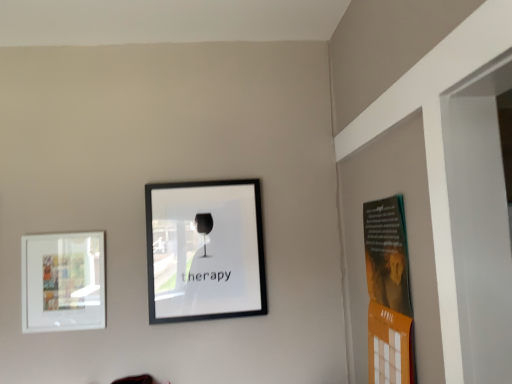
This screenshot has height=384, width=512. Describe the element at coordinates (205, 250) in the screenshot. I see `black matte picture frame at center, acting as the first picture frame starting from the right` at that location.

Identify the location of black matte picture frame at center, the 2th picture frame positioned from the left. (205, 250).

In order to face white matte picture frame at left, positioned as the first picture frame in left-to-right order, should I rotate leftwards or rightwards?

A 24.301 degree turn to the left will do.

You are a GUI agent. You are given a task and a screenshot of the screen. Output one action in this format:
    pyautogui.click(x=<x>, y=<y>)
    Task: Click on the white matte picture frame at left, positioned as the first picture frame in left-to-right order
    Image resolution: width=512 pixels, height=384 pixels.
    Given the screenshot: What is the action you would take?
    pyautogui.click(x=63, y=282)

What do you see at coordinates (63, 282) in the screenshot? Image resolution: width=512 pixels, height=384 pixels. I see `white matte picture frame at left, positioned as the first picture frame in left-to-right order` at bounding box center [63, 282].

At what (x,y) coordinates should I click in order to perform the action: click on black matte picture frame at center, the 2th picture frame positioned from the left. Please return your answer as a coordinate pair (x, y). The width and height of the screenshot is (512, 384). Looking at the image, I should click on click(x=205, y=250).

Based on their positions, is white matte picture frame at left, acting as the second picture frame starting from the right, located to the left or right of black matte picture frame at center, acting as the first picture frame starting from the right?

white matte picture frame at left, acting as the second picture frame starting from the right, is positioned on black matte picture frame at center, acting as the first picture frame starting from the right,'s left side.

From the picture: Is white matte picture frame at left, positioned as the first picture frame in left-to-right order, further to camera compared to black matte picture frame at center, the 2th picture frame positioned from the left?

That is False.

Is point (75, 244) closer to viewer compared to point (243, 285)?

Yes, it is in front of point (243, 285).

From the image's perspective, which is below, white matte picture frame at left, positioned as the first picture frame in left-to-right order, or black matte picture frame at center, the 2th picture frame positioned from the left?

white matte picture frame at left, positioned as the first picture frame in left-to-right order, from the image's perspective.

From a real-world perspective, is white matte picture frame at left, positioned as the first picture frame in left-to-right order, above or below black matte picture frame at center, acting as the first picture frame starting from the right?

From a real-world perspective, white matte picture frame at left, positioned as the first picture frame in left-to-right order, is physically below black matte picture frame at center, acting as the first picture frame starting from the right.

Considering the relative sizes of white matte picture frame at left, acting as the second picture frame starting from the right, and black matte picture frame at center, acting as the first picture frame starting from the right, in the image provided, is white matte picture frame at left, acting as the second picture frame starting from the right, thinner than black matte picture frame at center, acting as the first picture frame starting from the right,?

Correct, the width of white matte picture frame at left, acting as the second picture frame starting from the right, is less than that of black matte picture frame at center, acting as the first picture frame starting from the right.

Considering the sizes of objects white matte picture frame at left, positioned as the first picture frame in left-to-right order, and black matte picture frame at center, the 2th picture frame positioned from the left, in the image provided, who is shorter, white matte picture frame at left, positioned as the first picture frame in left-to-right order, or black matte picture frame at center, the 2th picture frame positioned from the left,?

With less height is white matte picture frame at left, positioned as the first picture frame in left-to-right order.

Does white matte picture frame at left, acting as the second picture frame starting from the right, have a smaller size compared to black matte picture frame at center, the 2th picture frame positioned from the left?

Indeed, white matte picture frame at left, acting as the second picture frame starting from the right, has a smaller size compared to black matte picture frame at center, the 2th picture frame positioned from the left.

Is white matte picture frame at left, positioned as the first picture frame in left-to-right order, situated inside black matte picture frame at center, the 2th picture frame positioned from the left, or outside?

white matte picture frame at left, positioned as the first picture frame in left-to-right order, exists outside the volume of black matte picture frame at center, the 2th picture frame positioned from the left.

Is white matte picture frame at left, positioned as the first picture frame in left-to-right order, not near black matte picture frame at center, acting as the first picture frame starting from the right?

No, white matte picture frame at left, positioned as the first picture frame in left-to-right order, is not far from black matte picture frame at center, acting as the first picture frame starting from the right.

Could you tell me if white matte picture frame at left, acting as the second picture frame starting from the right, is turned towards black matte picture frame at center, acting as the first picture frame starting from the right?

No, white matte picture frame at left, acting as the second picture frame starting from the right, is not turned towards black matte picture frame at center, acting as the first picture frame starting from the right.

How many degrees apart are the facing directions of white matte picture frame at left, acting as the second picture frame starting from the right, and black matte picture frame at center, the 2th picture frame positioned from the left?

0.0389 degrees.

Image resolution: width=512 pixels, height=384 pixels. Identify the location of picture frame that appears above the white matte picture frame at left, positioned as the first picture frame in left-to-right order (from a real-world perspective). (205, 250).

Which object is positioned more to the right, black matte picture frame at center, the 2th picture frame positioned from the left, or white matte picture frame at left, acting as the second picture frame starting from the right?

Positioned to the right is black matte picture frame at center, the 2th picture frame positioned from the left.

Between black matte picture frame at center, acting as the first picture frame starting from the right, and white matte picture frame at left, acting as the second picture frame starting from the right, which one is positioned behind?

black matte picture frame at center, acting as the first picture frame starting from the right, is more distant.

Which point is more forward, (x=167, y=302) or (x=42, y=268)?

The point (x=42, y=268) is more forward.

From the image's perspective, is black matte picture frame at center, acting as the first picture frame starting from the right, located above white matte picture frame at left, acting as the second picture frame starting from the right?

Correct, black matte picture frame at center, acting as the first picture frame starting from the right, appears higher than white matte picture frame at left, acting as the second picture frame starting from the right, in the image.

From a real-world perspective, which is physically below, black matte picture frame at center, the 2th picture frame positioned from the left, or white matte picture frame at left, acting as the second picture frame starting from the right?

In real-world perspective, white matte picture frame at left, acting as the second picture frame starting from the right, is lower.

Considering the sizes of black matte picture frame at center, the 2th picture frame positioned from the left, and white matte picture frame at left, acting as the second picture frame starting from the right, in the image, is black matte picture frame at center, the 2th picture frame positioned from the left, wider or thinner than white matte picture frame at left, acting as the second picture frame starting from the right,?

Clearly, black matte picture frame at center, the 2th picture frame positioned from the left, has more width compared to white matte picture frame at left, acting as the second picture frame starting from the right.

From their relative heights in the image, would you say black matte picture frame at center, the 2th picture frame positioned from the left, is taller or shorter than white matte picture frame at left, acting as the second picture frame starting from the right?

Considering their sizes, black matte picture frame at center, the 2th picture frame positioned from the left, has more height than white matte picture frame at left, acting as the second picture frame starting from the right.

Does black matte picture frame at center, the 2th picture frame positioned from the left, have a larger size compared to white matte picture frame at left, positioned as the first picture frame in left-to-right order?

Indeed, black matte picture frame at center, the 2th picture frame positioned from the left, has a larger size compared to white matte picture frame at left, positioned as the first picture frame in left-to-right order.

Would you say black matte picture frame at center, the 2th picture frame positioned from the left, contains white matte picture frame at left, positioned as the first picture frame in left-to-right order?

No, white matte picture frame at left, positioned as the first picture frame in left-to-right order, is not surrounded by black matte picture frame at center, the 2th picture frame positioned from the left.

Would you consider black matte picture frame at center, acting as the first picture frame starting from the right, to be distant from white matte picture frame at left, acting as the second picture frame starting from the right?

black matte picture frame at center, acting as the first picture frame starting from the right, is near white matte picture frame at left, acting as the second picture frame starting from the right, not far away.

Could you tell me if black matte picture frame at center, the 2th picture frame positioned from the left, is facing white matte picture frame at left, positioned as the first picture frame in left-to-right order?

No, black matte picture frame at center, the 2th picture frame positioned from the left, is not aimed at white matte picture frame at left, positioned as the first picture frame in left-to-right order.

At what (x,y) coordinates should I click in order to perform the action: click on picture frame that appears in front of the black matte picture frame at center, acting as the first picture frame starting from the right. Please return your answer as a coordinate pair (x, y). Looking at the image, I should click on (63, 282).

The width and height of the screenshot is (512, 384). Find the location of `picture frame to the left of black matte picture frame at center, the 2th picture frame positioned from the left`. picture frame to the left of black matte picture frame at center, the 2th picture frame positioned from the left is located at coordinates (63, 282).

The width and height of the screenshot is (512, 384). In order to click on picture frame directly beneath the black matte picture frame at center, acting as the first picture frame starting from the right (from a real-world perspective) in this screenshot , I will do [x=63, y=282].